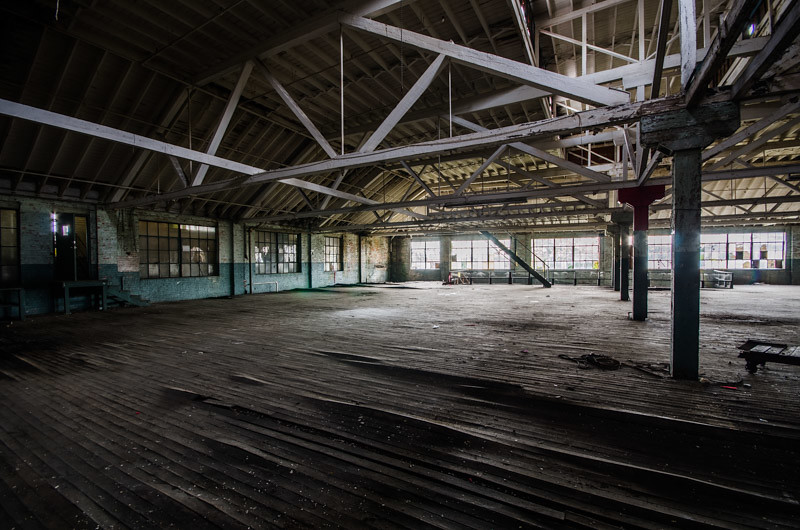
Locate an element on the screen. The width and height of the screenshot is (800, 530). pillar is located at coordinates (684, 237), (637, 242), (625, 254), (618, 264).